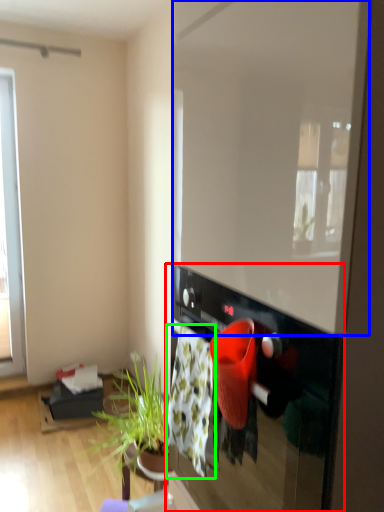
Question: Which is farther away from oven (highlighted by a red box)? window screen (highlighted by a blue box) or blanket (highlighted by a green box)?

Choices:
 (A) window screen
 (B) blanket

Answer: (A)